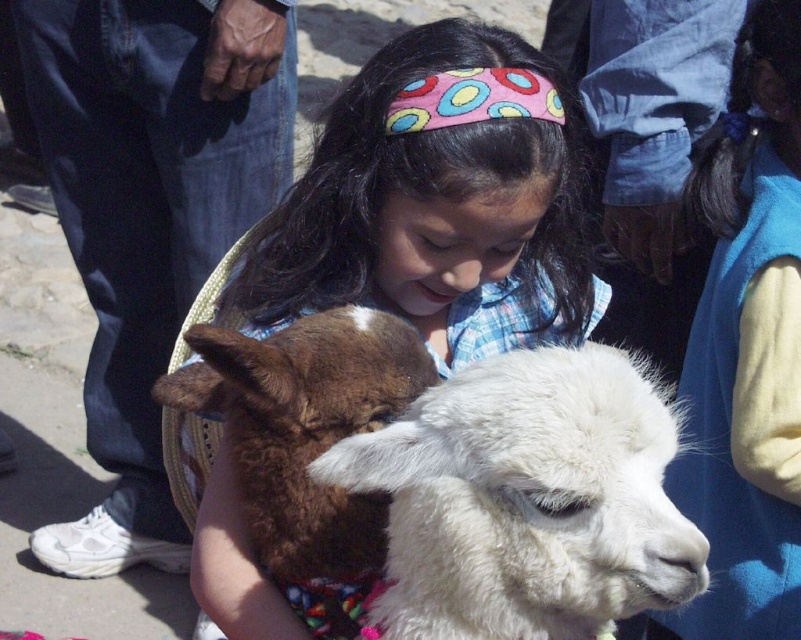
You are standing at the point marked as point (411,240) and want to move to the point marked as point (610,532). Which direction should you move to reach your destination?

You should move forward because point (610,532) is in front of point (411,240).

You are a photographer trying to capture a closeup shot of the two alpacas. You have a camera with a 10 inch wide lens. Can you fit both the white fluffy alpaca at center and the fluffy white alpaca at center into your shot without moving the camera?

The white fluffy alpaca at center and the fluffy white alpaca at center are 8.95 inches apart from each other. Since the distance between them is less than the 10 inch width of the lens, you can fit both into the shot without moving the camera.

You are a photographer standing at the point marked as point (445, 477). You want to take a photo of the two alpacas and the girl. To ensure all three subjects are in focus, what is the minimum distance you should set your camera lens to?

The minimum distance should be set to 76.65 centimeters to ensure all three subjects are in focus since they are 76.65 centimeters apart.